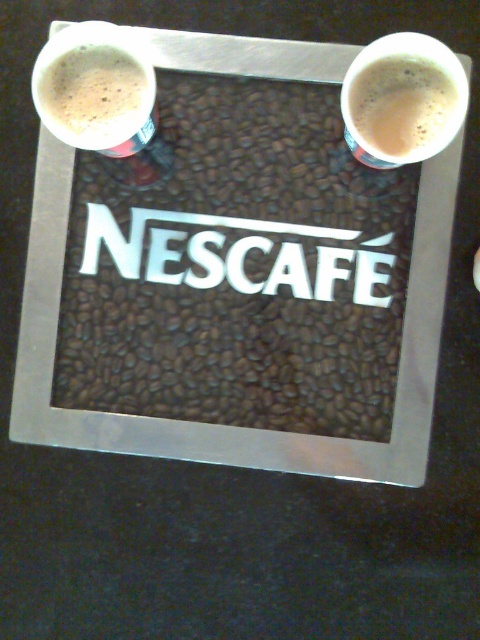
Question: Does matte white cup at upper left have a lesser width compared to white frothy coffee at upper right?

Choices:
 (A) yes
 (B) no

Answer: (B)

Question: Which of the following is the farthest from the observer?

Choices:
 (A) white frothy coffee at upper right
 (B) matte white cup at upper left

Answer: (B)

Question: Can you confirm if matte white cup at upper left is positioned to the right of white frothy coffee at upper right?

Choices:
 (A) no
 (B) yes

Answer: (A)

Question: Can you confirm if matte white cup at upper left is positioned to the left of white frothy coffee at upper right?

Choices:
 (A) yes
 (B) no

Answer: (A)